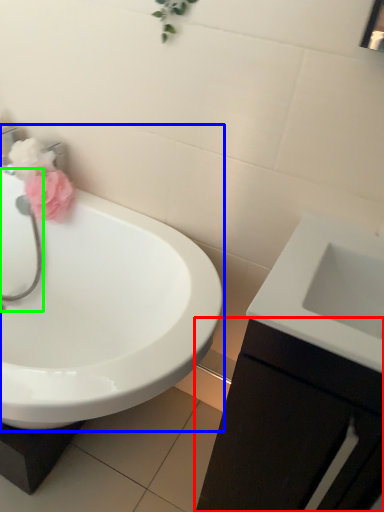
Question: Which object is positioned closest to bathroom cabinet (highlighted by a red box)? Select from sink (highlighted by a blue box) and plumbing fixture (highlighted by a green box).

Choices:
 (A) sink
 (B) plumbing fixture

Answer: (A)